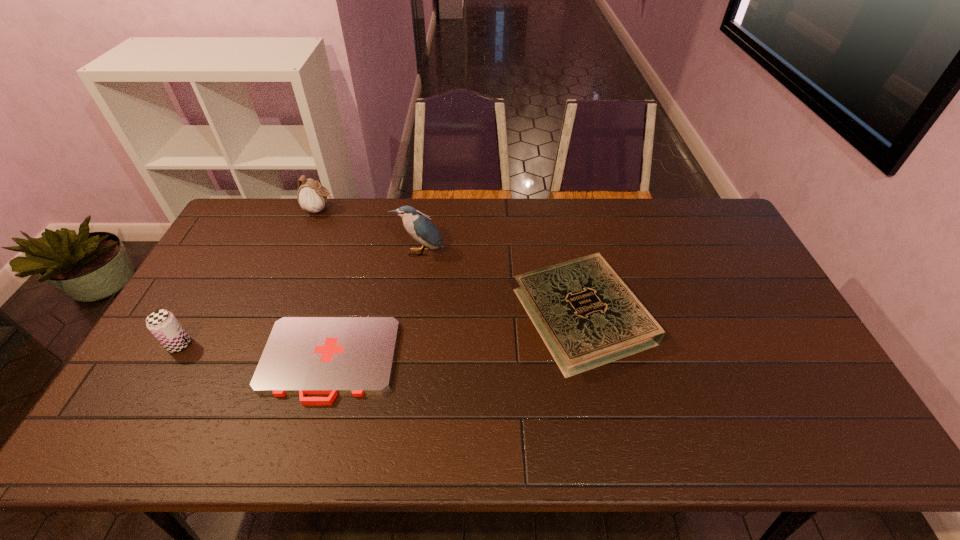
This screenshot has width=960, height=540. Find the location of `vacant space that satisfies the following two spatial constraints: 1. at the tip of the second shortest object's beak; 2. on the right side of the bird`. vacant space that satisfies the following two spatial constraints: 1. at the tip of the second shortest object's beak; 2. on the right side of the bird is located at coordinates (410, 316).

The image size is (960, 540). Identify the location of vacant space that satisfies the following two spatial constraints: 1. on the front-facing side of the rightmost object; 2. on the right side of the farthest object. (276, 316).